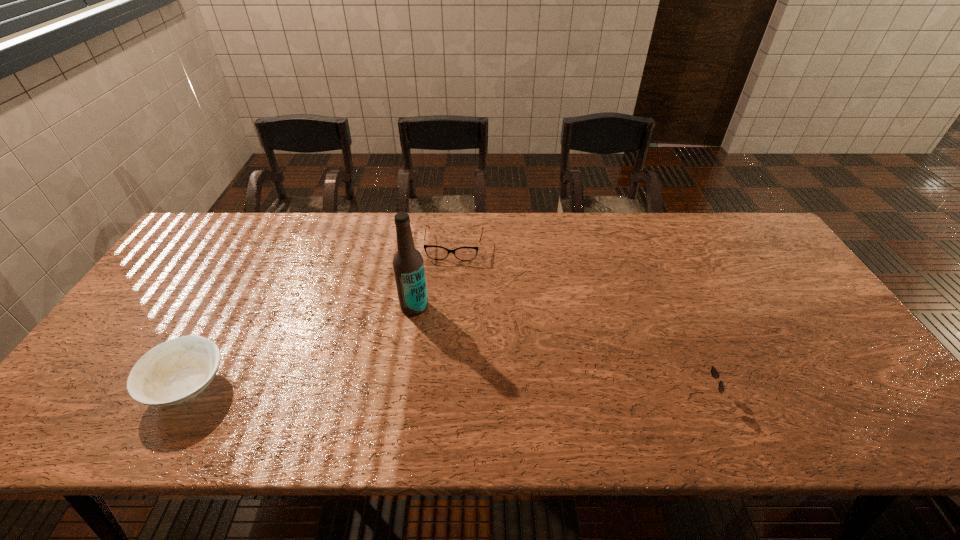
I want to click on blank area located 0.350m on the front-facing side of the farthest object, so 438,353.

Where is `blank area located on the label of the third nearest object`? The image size is (960, 540). blank area located on the label of the third nearest object is located at coordinates (394, 341).

What are the coordinates of `free space located 0.190m on the label of the third nearest object` in the screenshot? It's located at (375, 373).

Identify the location of free space located 0.260m on the label of the third nearest object. (361, 397).

Find the location of a particular element. This screenshot has height=540, width=960. object that is at the far edge is located at coordinates (434, 252).

Locate an element on the screen. The height and width of the screenshot is (540, 960). bowl at the near edge is located at coordinates (173, 372).

This screenshot has width=960, height=540. I want to click on sunglasses present at the near edge, so click(714, 372).

Locate an element on the screen. The height and width of the screenshot is (540, 960). free spot at the far edge of the desktop is located at coordinates (426, 240).

In the image, there is a desktop. Where is `vacant space at the near edge`? The image size is (960, 540). vacant space at the near edge is located at coordinates (331, 392).

The image size is (960, 540). I want to click on vacant point at the left edge, so click(195, 278).